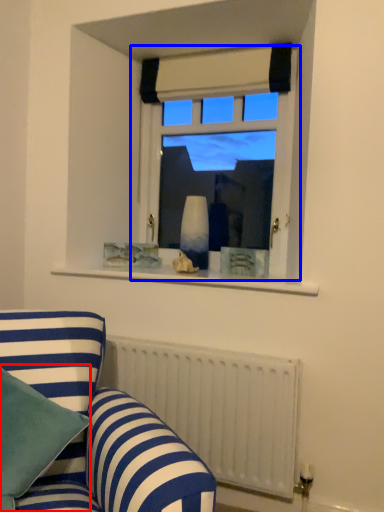
Question: Which of the following is the farthest to the observer, pillow (highlighted by a red box) or window (highlighted by a blue box)?

Choices:
 (A) pillow
 (B) window

Answer: (B)